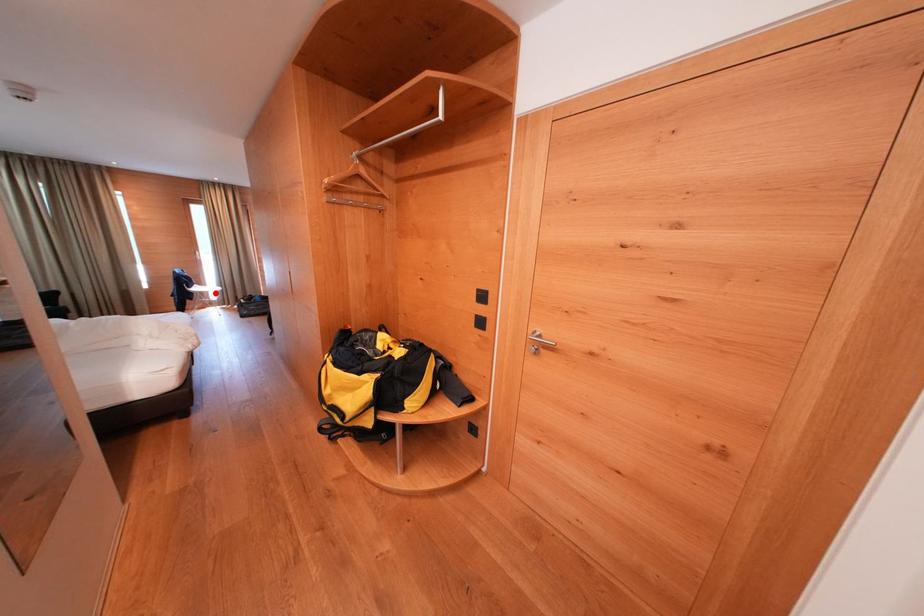
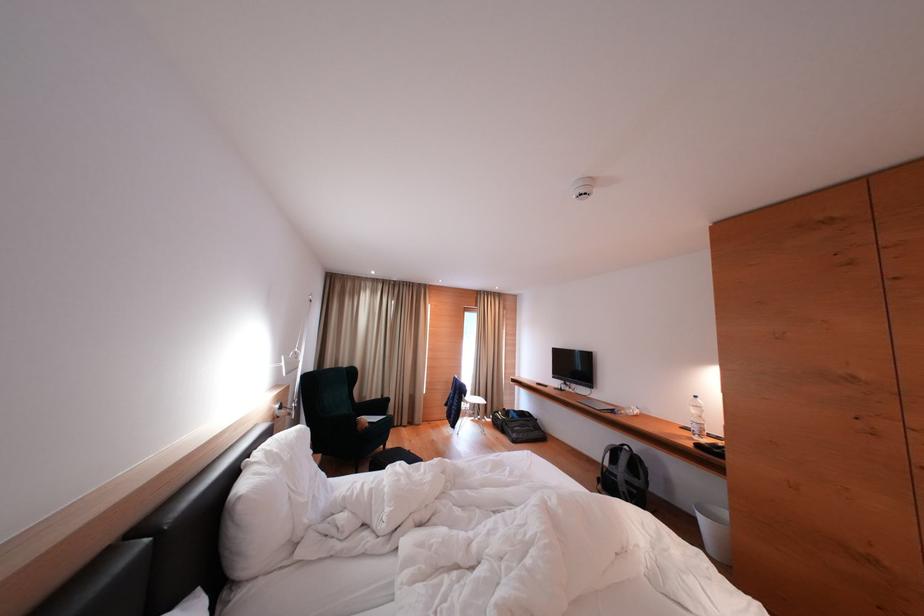
Locate, in the second image, the point that corresponds to the highlighted location in the first image.

(477, 402)